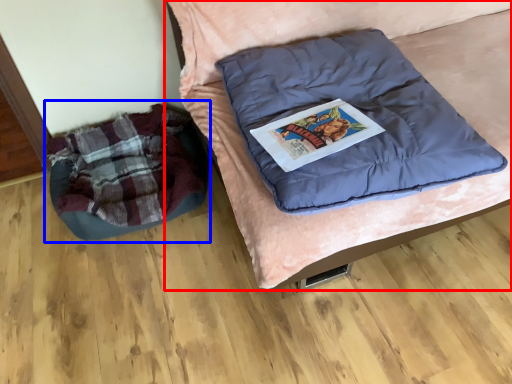
Question: Which point is closer to the camera, furniture (highlighted by a red box) or bean bag chair (highlighted by a blue box)?

Choices:
 (A) furniture
 (B) bean bag chair

Answer: (A)